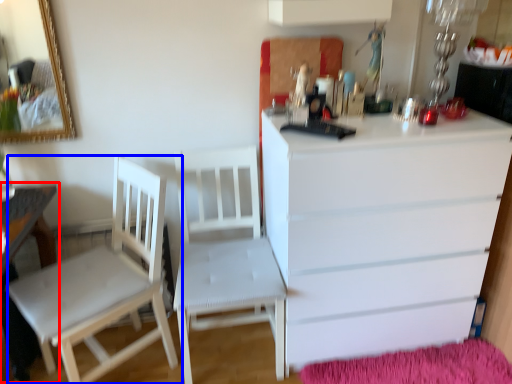
Question: Which object is closer to the camera taking this photo, table (highlighted by a red box) or chair (highlighted by a blue box)?

Choices:
 (A) table
 (B) chair

Answer: (A)